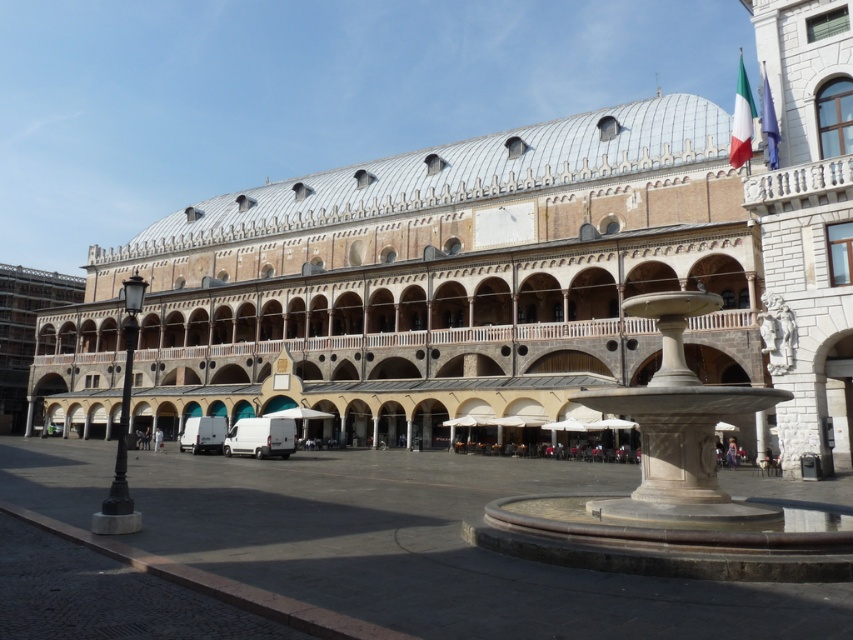
Question: Which of the following is the farthest from the observer?

Choices:
 (A) white marble fountain at center
 (B) beige stone palace at center

Answer: (B)

Question: From the image, what is the correct spatial relationship of beige stone palace at center in relation to white marble fountain at center?

Choices:
 (A) above
 (B) below

Answer: (A)

Question: Which point is closer to the camera?

Choices:
 (A) beige stone palace at center
 (B) white marble fountain at center

Answer: (B)

Question: Can you confirm if beige stone palace at center is positioned to the left of white marble fountain at center?

Choices:
 (A) no
 (B) yes

Answer: (B)

Question: Is beige stone palace at center to the right of white marble fountain at center from the viewer's perspective?

Choices:
 (A) yes
 (B) no

Answer: (B)